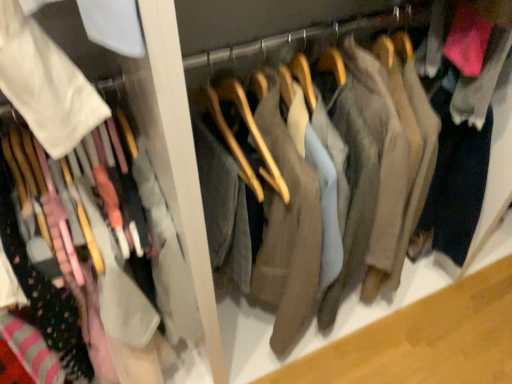
Question: Should I look upward or downward to see matte white shirt at left?

Choices:
 (A) down
 (B) up

Answer: (A)